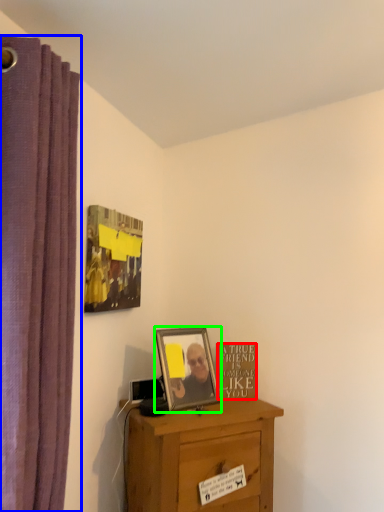
Question: Considering the real-world distances, which object is closest to writing (highlighted by a red box)? curtain (highlighted by a blue box) or picture frame (highlighted by a green box).

Choices:
 (A) curtain
 (B) picture frame

Answer: (B)